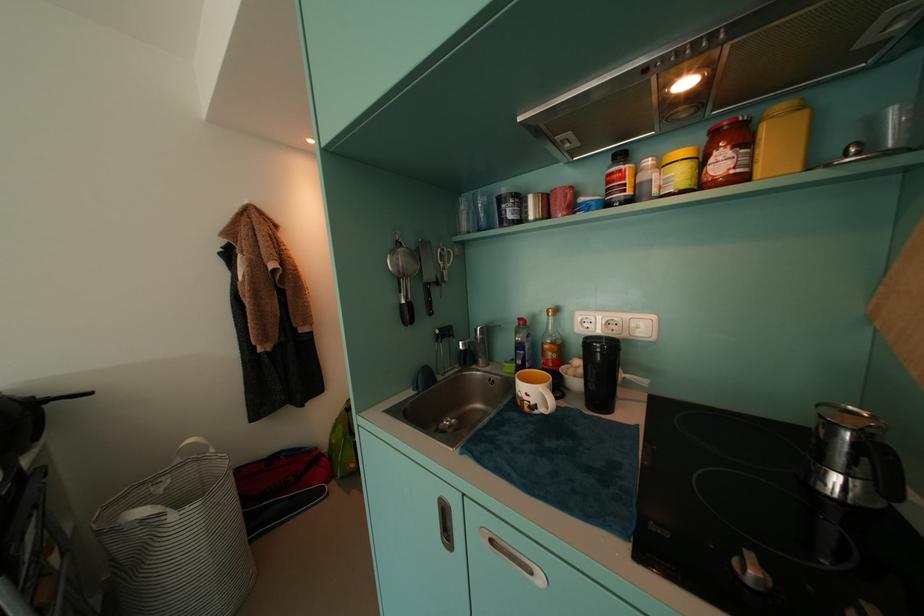
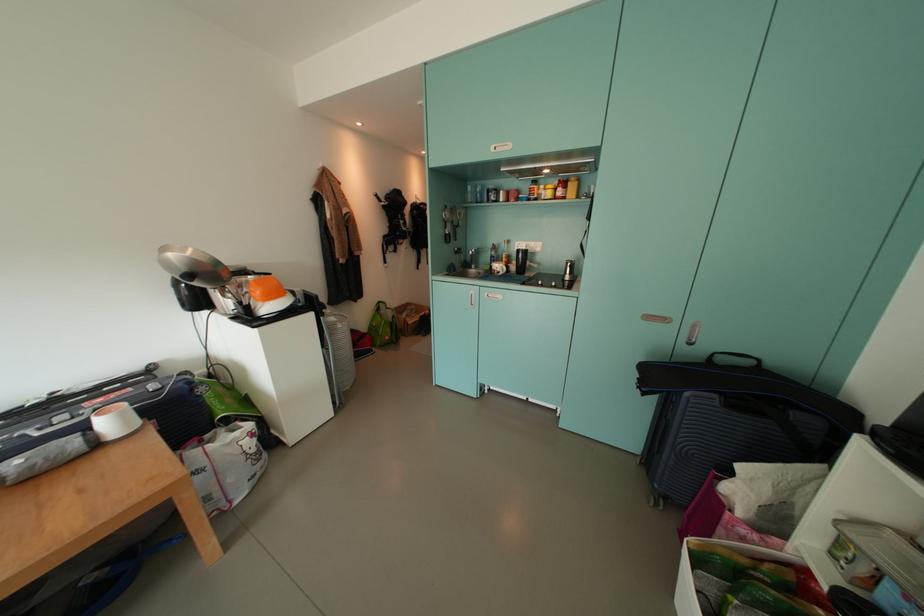
Where in the second image is the point corresponding to point 730,166 from the first image?

(566, 195)